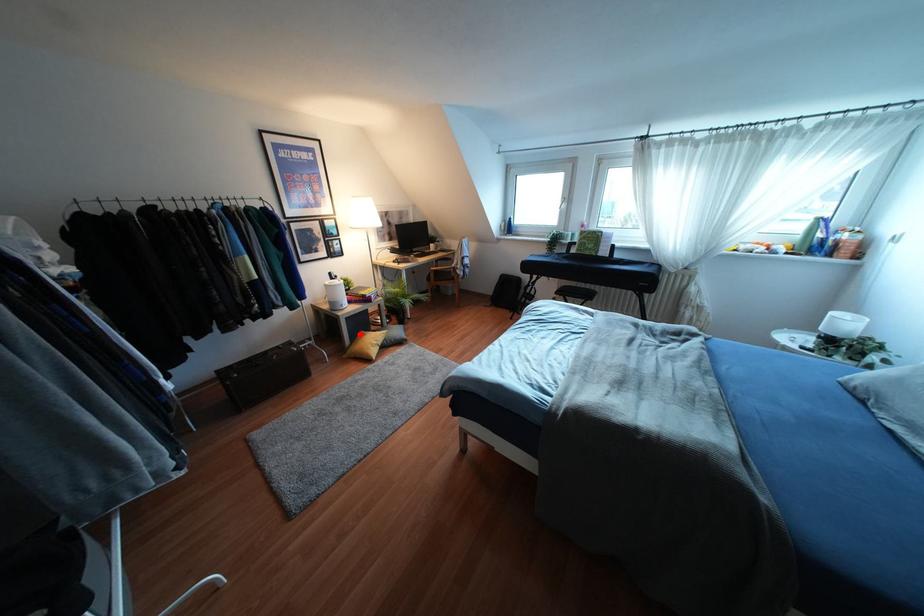
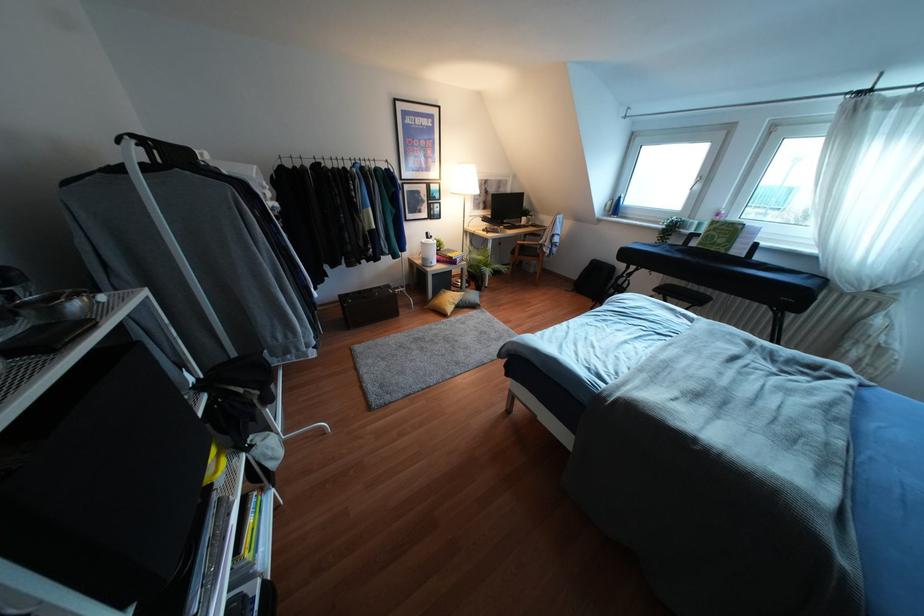
Locate, in the second image, the point that corresponds to the highlighted location in the first image.

(441, 292)